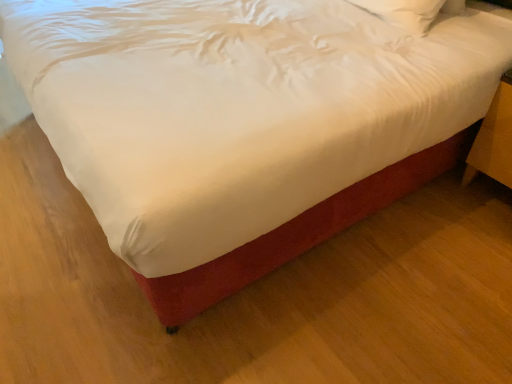
The image size is (512, 384). What do you see at coordinates (494, 139) in the screenshot? I see `wooden nightstand at lower right` at bounding box center [494, 139].

What are the coordinates of `wooden nightstand at lower right` in the screenshot? It's located at (494, 139).

In the scene shown: Measure the distance between point (470, 154) and camera.

The depth of point (470, 154) is 1.92 meters.

The image size is (512, 384). I want to click on wooden nightstand at lower right, so click(x=494, y=139).